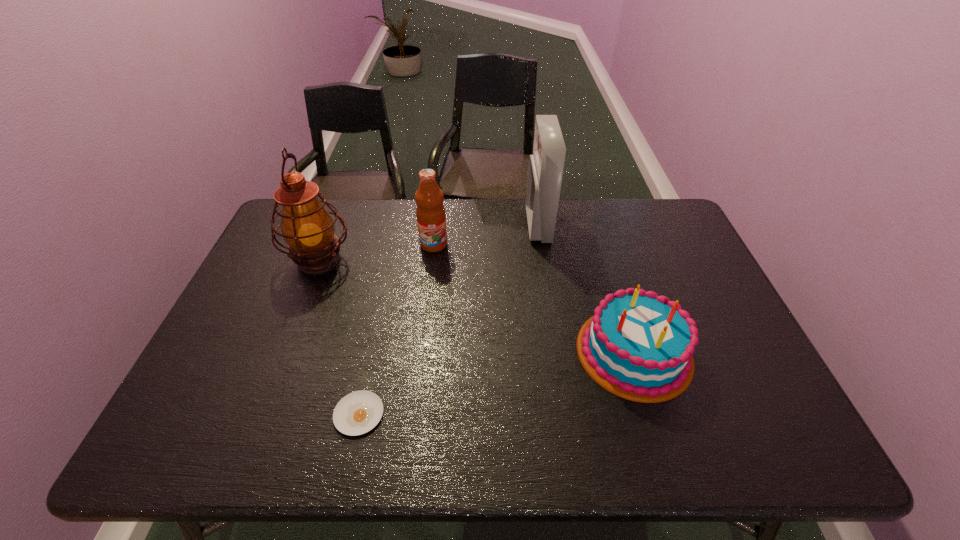
Identify the location of object that is at the right edge. The width and height of the screenshot is (960, 540). (637, 344).

This screenshot has height=540, width=960. Find the location of `object that is positioned at the far left corner`. object that is positioned at the far left corner is located at coordinates (307, 227).

Image resolution: width=960 pixels, height=540 pixels. I want to click on free space at the far edge, so click(x=451, y=205).

Identify the location of vacant space at the near edge of the desktop. (366, 438).

The height and width of the screenshot is (540, 960). Identify the location of blank space at the right edge of the desktop. (656, 242).

This screenshot has height=540, width=960. I want to click on blank area at the near left corner, so click(x=173, y=444).

This screenshot has width=960, height=540. I want to click on vacant space at the far right corner, so click(646, 240).

You are a GUI agent. You are given a task and a screenshot of the screen. Output one action in this format:
    pyautogui.click(x=<x>, y=<y>)
    Task: Click on the vacant space at the near right corner of the desktop
    This screenshot has height=540, width=960.
    Given the screenshot: What is the action you would take?
    pyautogui.click(x=799, y=450)

Locate an element on the screen. free space between the birthday cake and the second object from right to left is located at coordinates (587, 289).

The width and height of the screenshot is (960, 540). Find the location of `free space that is in between the fruit juice and the egg yolk`. free space that is in between the fruit juice and the egg yolk is located at coordinates (396, 329).